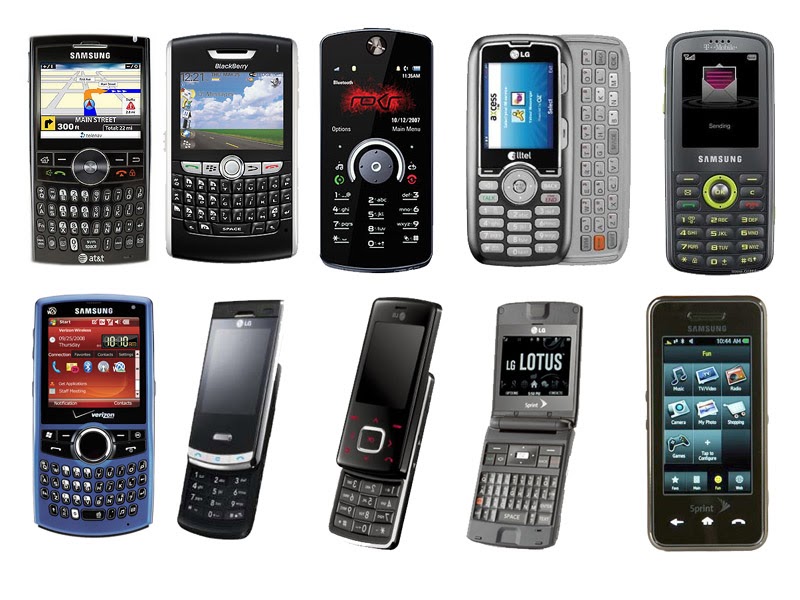
Where is `phone screens`? phone screens is located at coordinates (96, 376), (224, 388), (382, 381), (540, 369), (714, 381), (724, 109), (522, 111), (362, 103), (222, 120), (82, 109).